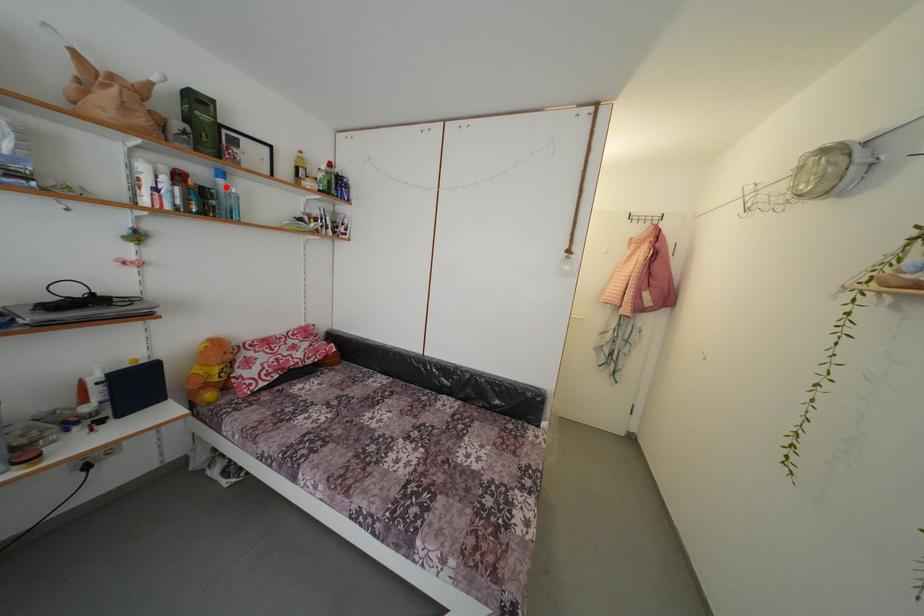
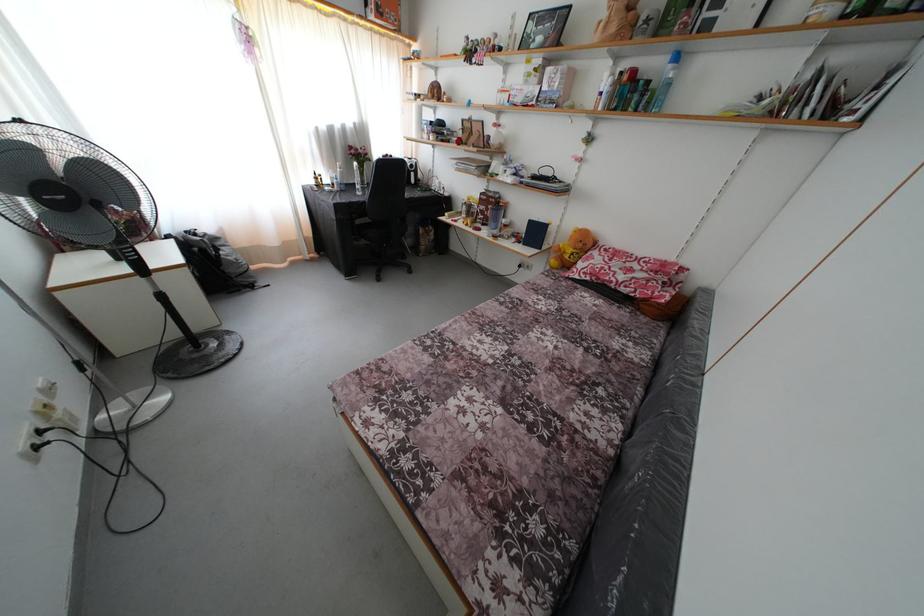
Find the pixel in the second image that matches the highlighted location in the first image.

(675, 73)